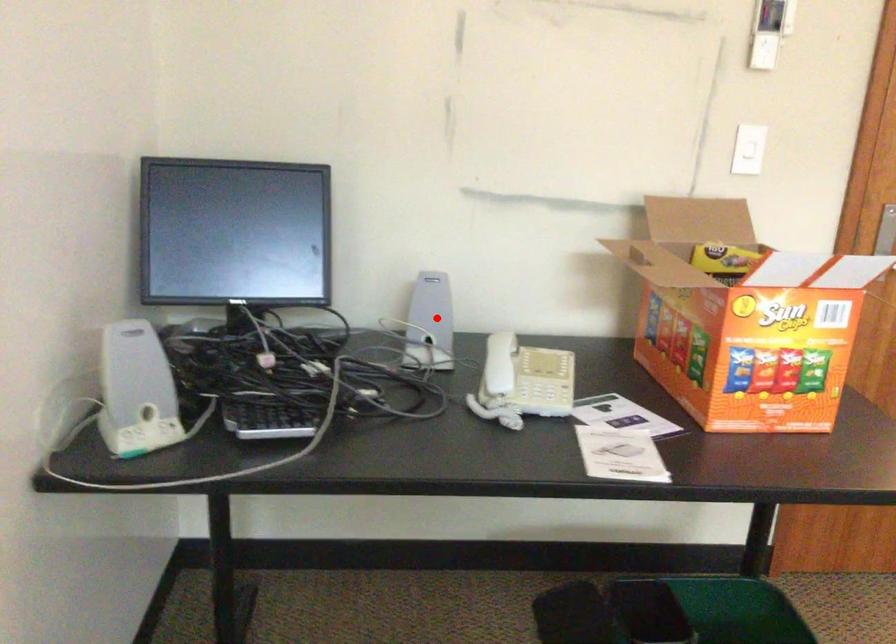
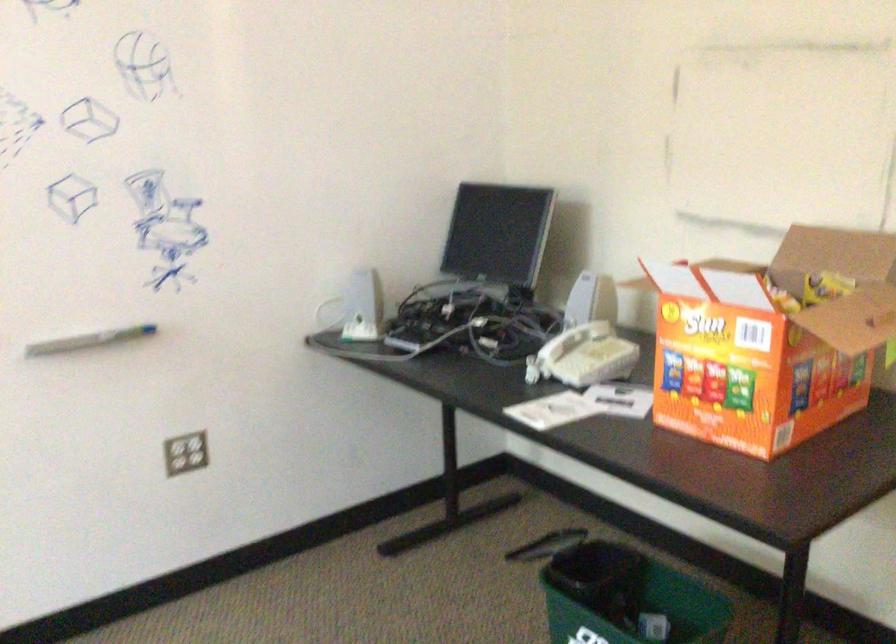
Question: I am providing you with two images of the same scene from different viewpoints. A red point is marked on the first image. Can you still see the location of the red point in image 2?

Choices:
 (A) Yes
 (B) No

Answer: (A)